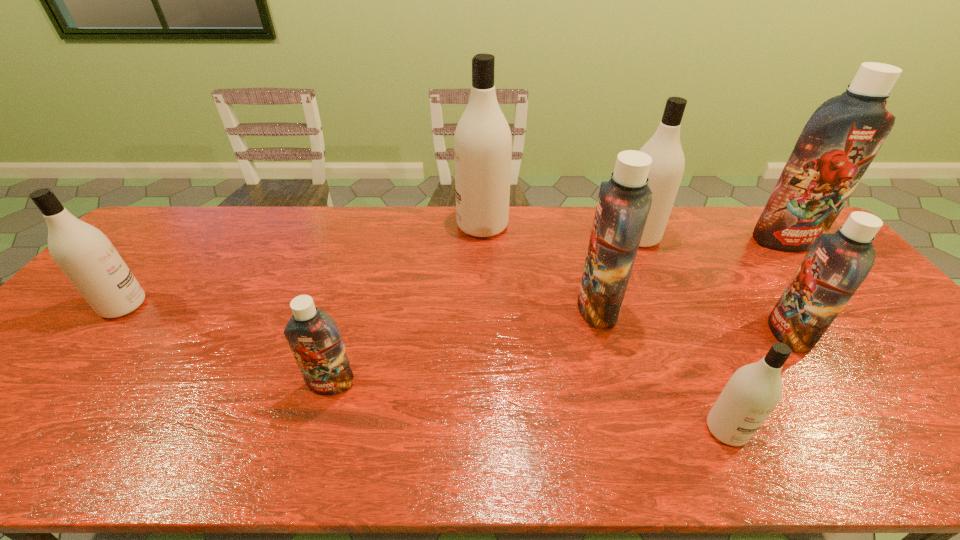
This screenshot has width=960, height=540. In order to click on the leftmost white shampoo in this screenshot , I will do `click(87, 257)`.

Identify the location of the seventh farthest object. The height and width of the screenshot is (540, 960). (315, 340).

Locate an element on the screen. The image size is (960, 540). the seventh object from right to left is located at coordinates (315, 340).

Locate an element on the screen. The height and width of the screenshot is (540, 960). the nearest object is located at coordinates (751, 394).

Where is `the nearest shampoo`? The image size is (960, 540). the nearest shampoo is located at coordinates pos(751,394).

Where is `vacant space situated on the front-facing side of the third object from left to right`? Image resolution: width=960 pixels, height=540 pixels. vacant space situated on the front-facing side of the third object from left to right is located at coordinates (410, 225).

Where is `vacant space located on the front-facing side of the third object from left to right`? This screenshot has width=960, height=540. vacant space located on the front-facing side of the third object from left to right is located at coordinates (360, 225).

I want to click on free space located 0.340m on the front-facing side of the third object from left to right, so pyautogui.click(x=357, y=225).

Locate an element on the screen. The height and width of the screenshot is (540, 960). free space located 0.280m on the front label of the biggest blue shampoo is located at coordinates (851, 319).

Locate an element on the screen. The width and height of the screenshot is (960, 540). vacant region located on the front-facing side of the third smallest white shampoo is located at coordinates (567, 237).